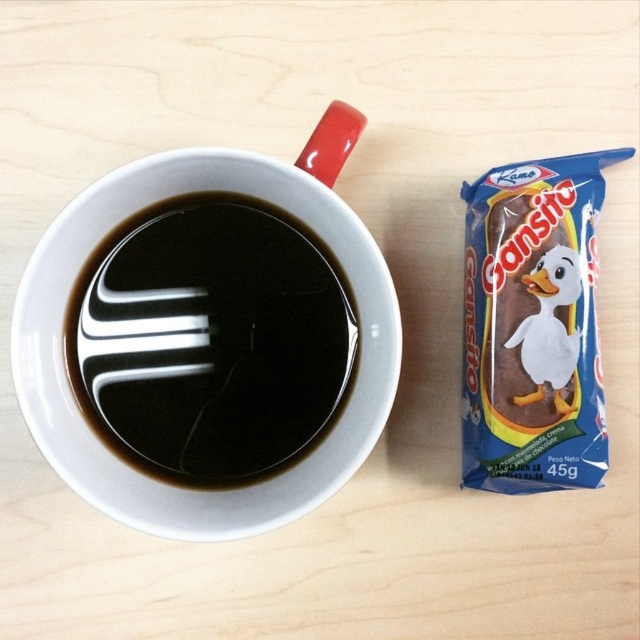
Question: Which of the following is the farthest from the observer?

Choices:
 (A) black glossy coffee cup at upper left
 (B) brown chocolate wafer at right

Answer: (B)

Question: Does black glossy coffee cup at upper left have a smaller size compared to brown chocolate wafer at right?

Choices:
 (A) no
 (B) yes

Answer: (B)

Question: Which object is closer to the camera taking this photo?

Choices:
 (A) brown chocolate wafer at right
 (B) black glossy coffee cup at upper left

Answer: (B)

Question: Is black glossy coffee cup at upper left further to camera compared to brown chocolate wafer at right?

Choices:
 (A) no
 (B) yes

Answer: (A)

Question: Does black glossy coffee cup at upper left appear under brown chocolate wafer at right?

Choices:
 (A) yes
 (B) no

Answer: (A)

Question: Which point is farther to the camera?

Choices:
 (A) (561, 420)
 (B) (140, 353)

Answer: (A)